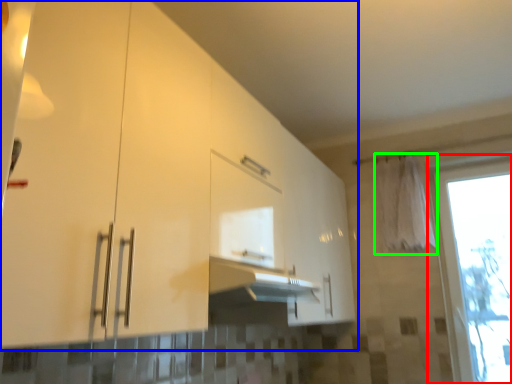
Question: Which object is positioned farthest from window (highlighted by a red box)? Select from cabinetry (highlighted by a blue box) and curtain (highlighted by a green box).

Choices:
 (A) cabinetry
 (B) curtain

Answer: (A)